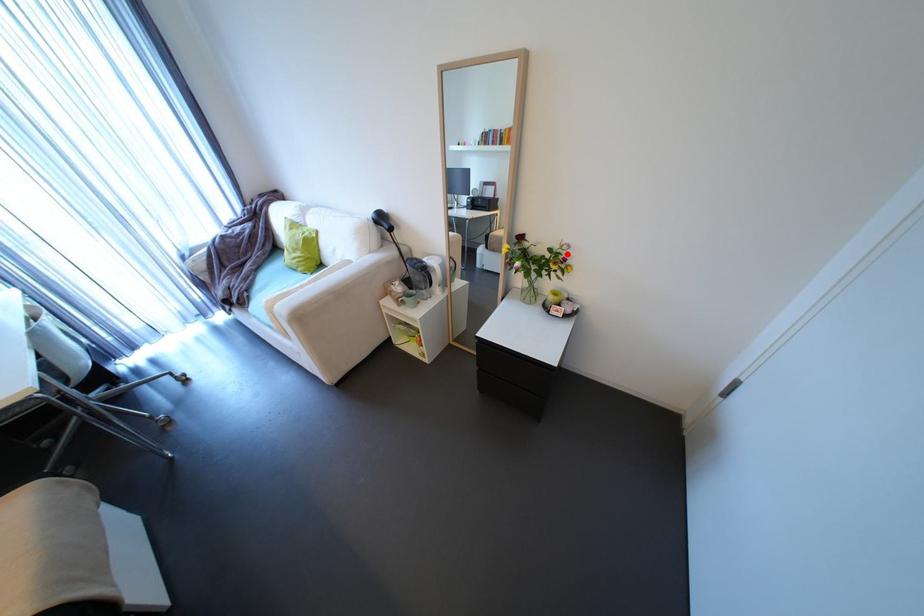
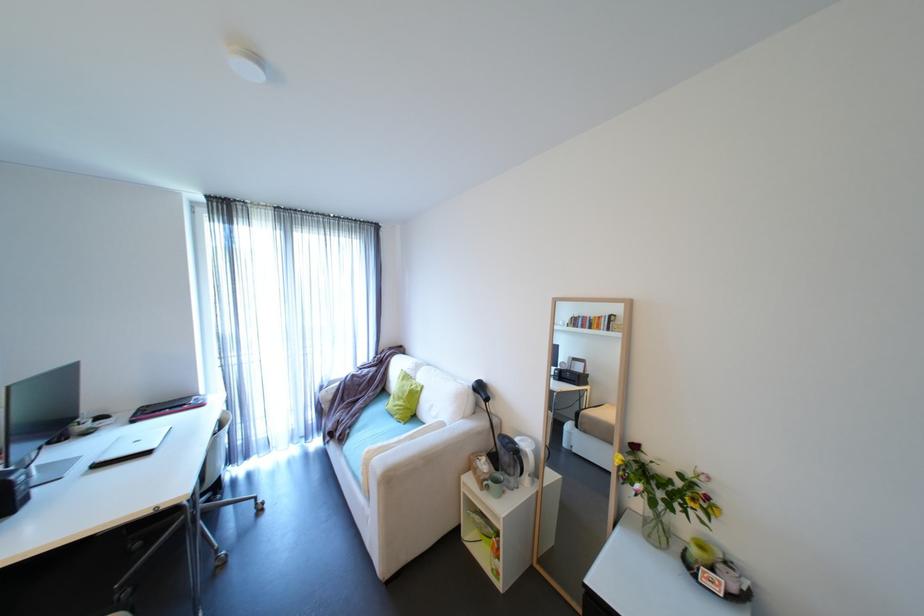
Where in the second image is the point corresponding to the highlighted location from the first image?

(703, 485)